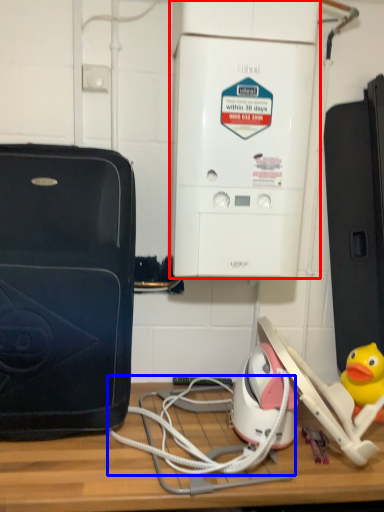
Question: Which object is further to the camera taking this photo, home appliance (highlighted by a red box) or cable (highlighted by a blue box)?

Choices:
 (A) home appliance
 (B) cable

Answer: (A)